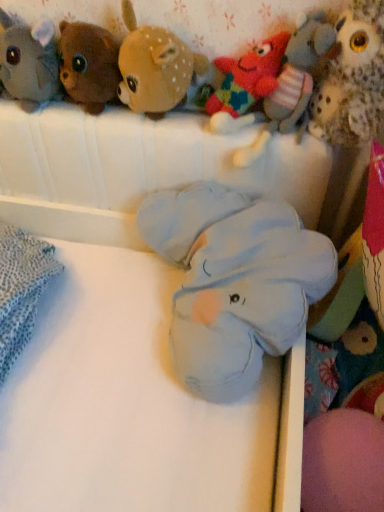
Question: Is soft blue plush elephant at center, the fourth toy viewed from the left, taller or shorter than soft blue plush elephant at center?

Choices:
 (A) tall
 (B) short

Answer: (B)

Question: Choose the correct answer: Is soft blue plush elephant at center, which appears as the fourth toy when viewed from the right, inside soft blue plush elephant at center or outside it?

Choices:
 (A) inside
 (B) outside

Answer: (A)

Question: Considering the real-world distances, which object is farthest from the soft plush bear at upper left, arranged as the 7th toy when viewed from the right?

Choices:
 (A) soft plush deer at upper center, which is the 5th toy from right to left
 (B) knitted wool starfish at upper center, arranged as the fifth toy when viewed from the left
 (C) fluffy plush star at upper right, positioned as the sixth toy in left-to-right order
 (D) fluffy brown owl at upper right, which appears as the seventh toy when viewed from the left
 (E) soft blue plush elephant at center

Answer: (D)

Question: Which object is the closest to the soft blue plush elephant at center, which appears as the fourth toy when viewed from the right?

Choices:
 (A) knitted wool starfish at upper center, marked as the 3th toy in a right-to-left arrangement
 (B) fluffy plush star at upper right, acting as the 2th toy starting from the right
 (C) soft plush bear at upper left, arranged as the 7th toy when viewed from the right
 (D) soft blue plush elephant at center
 (E) fluffy brown owl at upper right, which appears as the seventh toy when viewed from the left

Answer: (D)